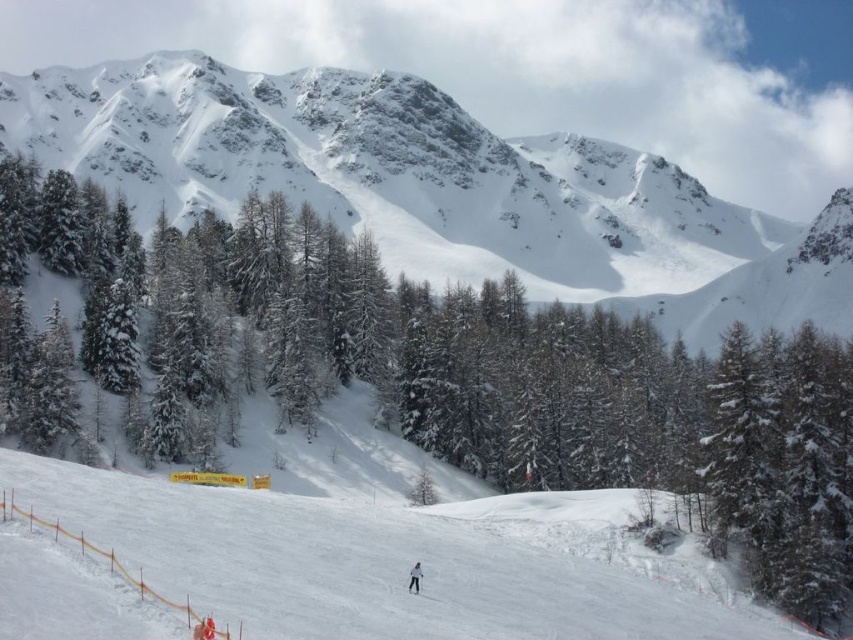
You are a skier preparing to descend the slope. You see the white snow ski slope at lower center and the black matte ski at center. Which object is located higher up the slope?

The white snow ski slope at lower center is positioned over the black matte ski at center, meaning it is higher up the slope.

You are a photographer planning to capture the white snowboarder at center and the black matte ski at center in a single shot. Based on their positions, will the ski be visible under the snowboarder in the photo?

The white snowboarder at center is positioned over the black matte ski at center, so yes, the ski will be visible under the snowboarder at center in the photo.

You are planning to take a photo of the snowy granite mountain at upper center and the black matte ski at center. Since you want both subjects to be in focus, you need to adjust your camera settings. Which subject should you focus on first to ensure both are sharp?

The snowy granite mountain at upper center is much taller than the black matte ski at center, so focusing on the snowy granite mountain at upper center first will help ensure both are in focus.